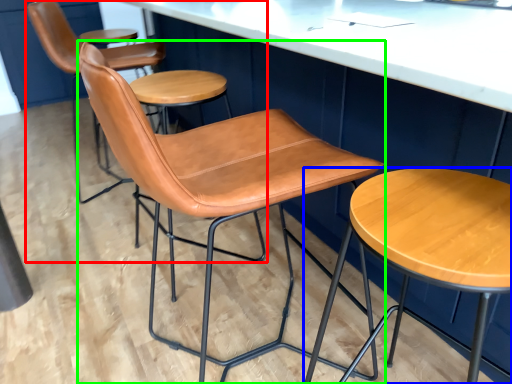
Question: Estimate the real-world distances between objects in this image. Which object is farther from chair (highlighted by a red box), stool (highlighted by a blue box) or chair (highlighted by a green box)?

Choices:
 (A) stool
 (B) chair

Answer: (A)